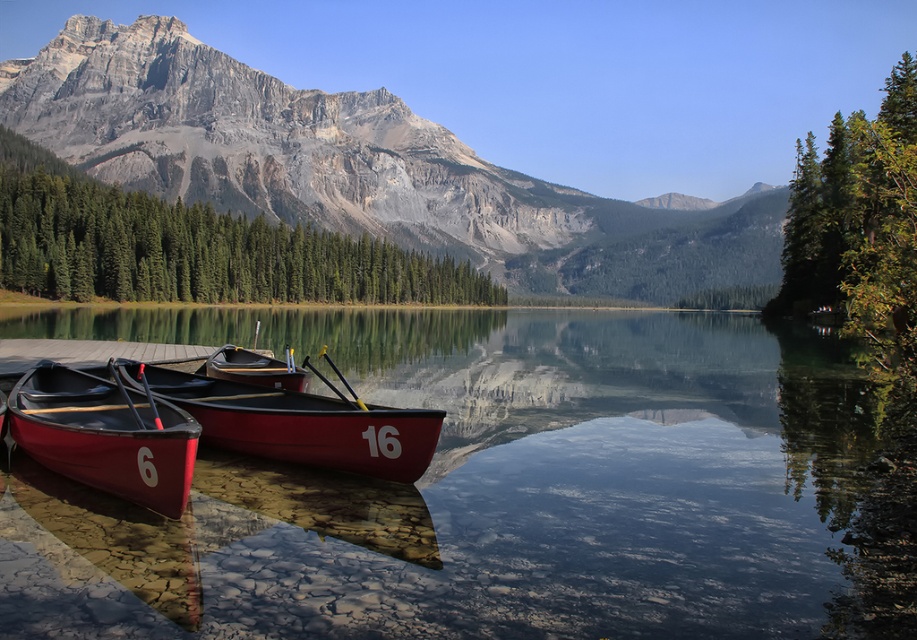
You are standing at the lakeside and want to throw a pebble to hit the matte gray rock at upper center. The pebble can travel up to 200 meters. Will it reach the rock?

The matte gray rock at upper center is 253.55 meters away from viewer. Since the pebble can only travel up to 200 meters, it will not reach the rock.

You are an observer standing on the lakeside dock. You notice the transparent glass water at center and the matte gray rock at upper center. Which object is positioned higher in the image?

The matte gray rock at upper center is positioned higher in the image than the transparent glass water at center, as it is located above it.

You are a photographer planning to capture the reflection of the matte red canoe at left and the matte black canoe at center in the lake. Since the water is still, which canoe do you think will have a clearer reflection?

The matte red canoe at left has a greater height compared to the matte black canoe at center. Since taller objects typically cast clearer reflections on still water, the matte red canoe at left will have a clearer reflection.